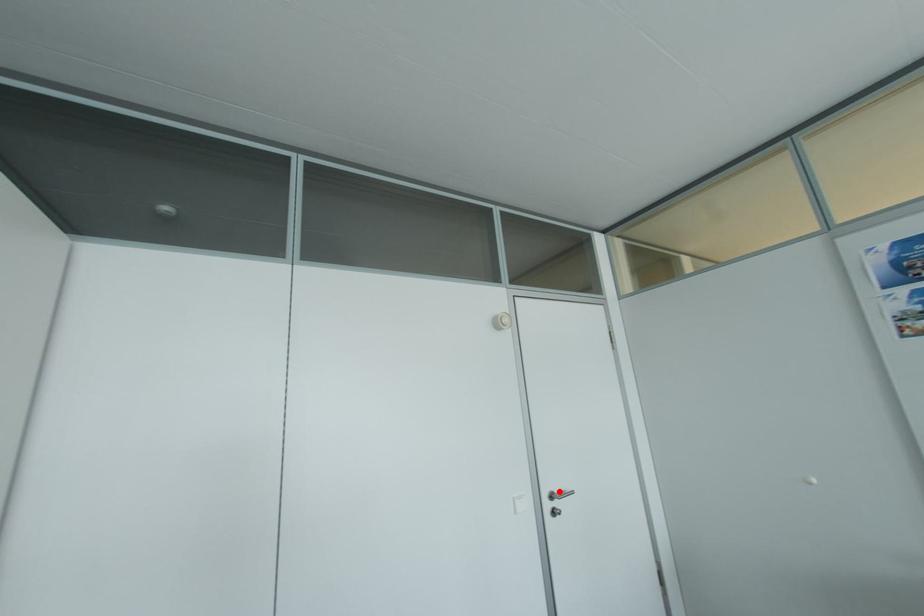
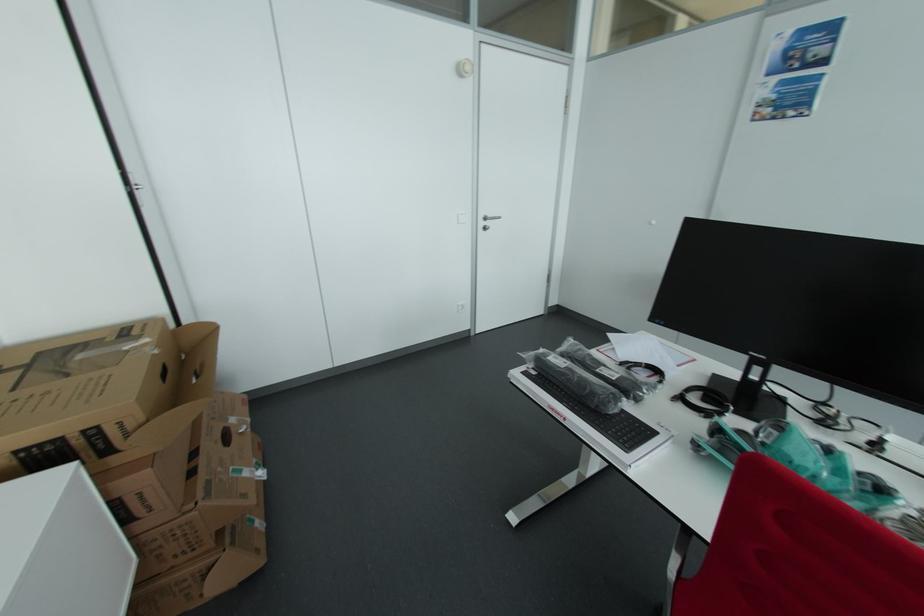
Where in the second image is the point corresponding to the highlighted location from the first image?

(493, 216)